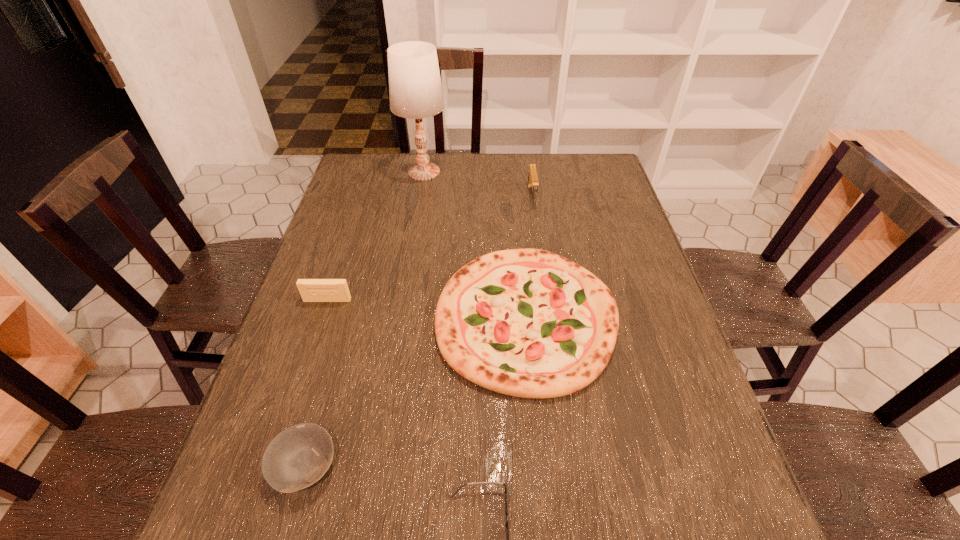
At what (x,y) coordinates should I click in order to perform the action: click on the tallest object. Please return your answer as a coordinate pair (x, y). Image resolution: width=960 pixels, height=540 pixels. Looking at the image, I should click on (415, 89).

Where is `pistol`? The image size is (960, 540). pistol is located at coordinates (532, 183).

Where is `videotape`? Image resolution: width=960 pixels, height=540 pixels. videotape is located at coordinates (311, 290).

You are a GUI agent. You are given a task and a screenshot of the screen. Output one action in this format:
    pyautogui.click(x=<x>, y=<y>)
    Task: Click on the pizza
    
    Given the screenshot: What is the action you would take?
    (529, 323)

I want to click on bowl, so click(x=299, y=456).

I want to click on vacant space positioned on the front of the tallest object, so click(409, 260).

This screenshot has height=540, width=960. In order to click on vacant area situated 0.050m at the barrel of the pistol in this screenshot , I will do `click(535, 219)`.

Find the location of `vacant space located 0.100m at the front of the videotape with spools`. vacant space located 0.100m at the front of the videotape with spools is located at coordinates (316, 335).

Identify the location of vacant space located on the back of the pizza. (516, 208).

At what (x,y) coordinates should I click in order to perform the action: click on vacant space situated 0.350m on the right of the bowl. Please return your answer as a coordinate pair (x, y). Image resolution: width=960 pixels, height=540 pixels. Looking at the image, I should click on (525, 466).